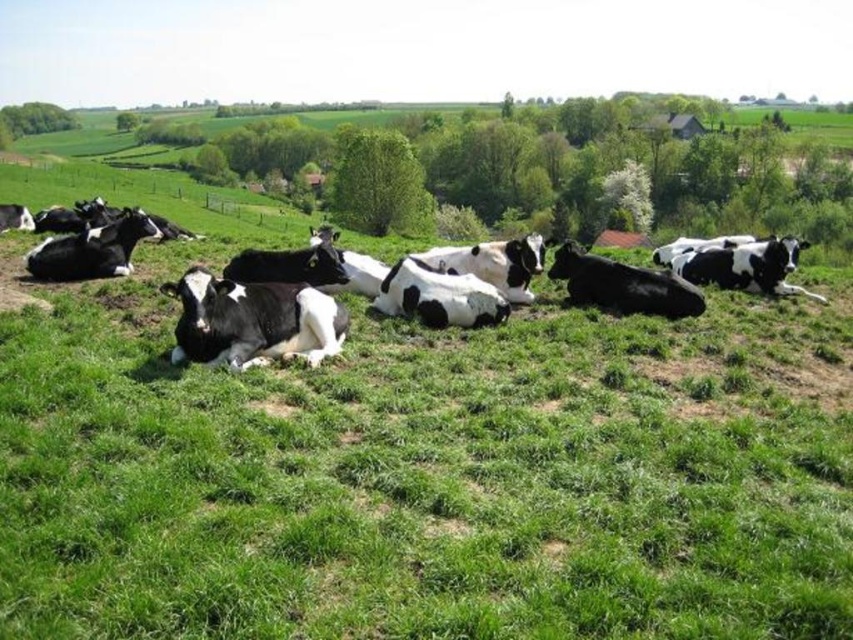
Question: Can you confirm if black and white fur at center is thinner than black and white cow at center?

Choices:
 (A) yes
 (B) no

Answer: (A)

Question: Which point appears closest to the camera in this image?

Choices:
 (A) (173, 349)
 (B) (596, 305)

Answer: (A)

Question: Is the position of black and white fur at center less distant than that of black smooth cow at center?

Choices:
 (A) no
 (B) yes

Answer: (B)

Question: Is black and white cow at center to the right of black smooth cow at center from the viewer's perspective?

Choices:
 (A) no
 (B) yes

Answer: (A)

Question: Estimate the real-world distances between objects in this image. Which object is farther from the black smooth cow at center?

Choices:
 (A) black and white fur at center
 (B) black and white cow at center

Answer: (A)

Question: Which point is closer to the camera?

Choices:
 (A) black smooth cow at center
 (B) black and white fur at center

Answer: (B)